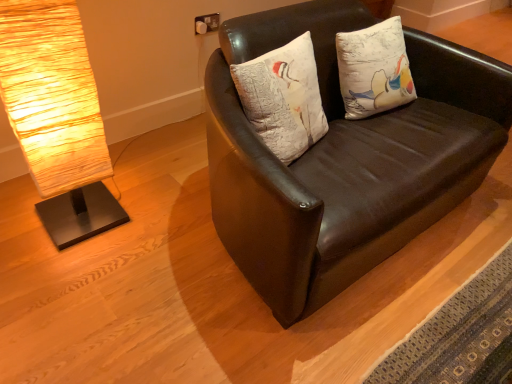
Question: From a real-world perspective, is white textured pillow at center physically located above or below rustic wood lamp at left?

Choices:
 (A) above
 (B) below

Answer: (A)

Question: Visually, is white textured pillow at center positioned to the left or to the right of rustic wood lamp at left?

Choices:
 (A) left
 (B) right

Answer: (B)

Question: Based on their relative distances, which object is nearer to the matte brown leather couch at center?

Choices:
 (A) white textured pillow at center
 (B) rustic wood lamp at left

Answer: (A)

Question: Which is farther from the white textured pillow at center?

Choices:
 (A) rustic wood lamp at left
 (B) matte brown leather couch at center

Answer: (A)